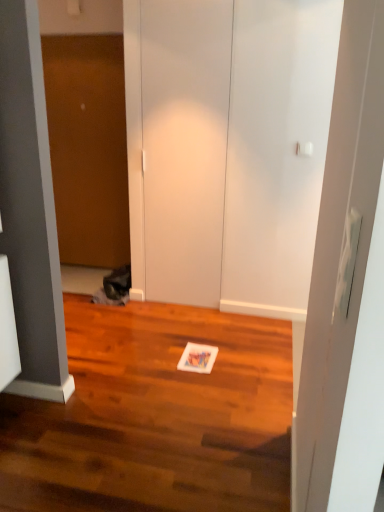
Question: Which is correct: wooden door at left, the second door from the front, is inside white matte door at center, the 2th door from the left, or outside of it?

Choices:
 (A) outside
 (B) inside

Answer: (A)

Question: Is point (125, 124) positioned closer to the camera than point (157, 137)?

Choices:
 (A) closer
 (B) farther

Answer: (B)

Question: Considering their positions, is wooden door at left, which ranks as the 1th door in left-to-right order, located in front of or behind white matte door at center, the first door from the front?

Choices:
 (A) behind
 (B) front

Answer: (A)

Question: Looking at their shapes, would you say white matte door at center, the first door from the front, is wider or thinner than wooden door at left, which ranks as the 1th door in left-to-right order?

Choices:
 (A) wide
 (B) thin

Answer: (B)

Question: In terms of height, does white matte door at center, acting as the 1th door starting from the right, look taller or shorter compared to wooden door at left, the second door from the front?

Choices:
 (A) tall
 (B) short

Answer: (A)

Question: Is point (208, 303) closer or farther from the camera than point (107, 67)?

Choices:
 (A) closer
 (B) farther

Answer: (A)

Question: Looking at the image, does white matte door at center, acting as the second door starting from the back, seem bigger or smaller compared to wooden door at left, which is counted as the 1th door, starting from the back?

Choices:
 (A) big
 (B) small

Answer: (B)